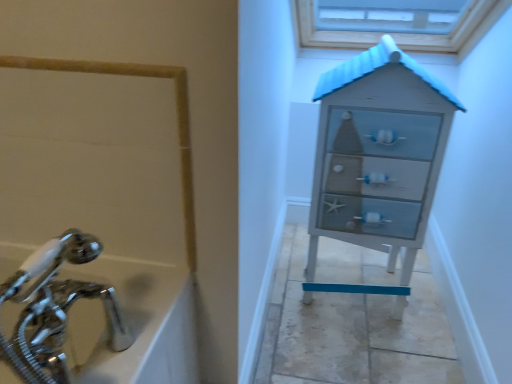
Question: Is distressed white chest of drawers at right taller or shorter than chrome metallic faucet at lower left?

Choices:
 (A) tall
 (B) short

Answer: (A)

Question: From a real-world perspective, is distressed white chest of drawers at right physically located above or below chrome metallic faucet at lower left?

Choices:
 (A) above
 (B) below

Answer: (B)

Question: Looking at their shapes, would you say distressed white chest of drawers at right is wider or thinner than chrome metallic faucet at lower left?

Choices:
 (A) wide
 (B) thin

Answer: (A)

Question: Based on their positions, is chrome metallic faucet at lower left located to the left or right of distressed white chest of drawers at right?

Choices:
 (A) left
 (B) right

Answer: (A)

Question: Is chrome metallic faucet at lower left situated inside distressed white chest of drawers at right or outside?

Choices:
 (A) inside
 (B) outside

Answer: (B)

Question: Considering the positions of chrome metallic faucet at lower left and distressed white chest of drawers at right in the image, is chrome metallic faucet at lower left wider or thinner than distressed white chest of drawers at right?

Choices:
 (A) thin
 (B) wide

Answer: (A)

Question: From a real-world perspective, is chrome metallic faucet at lower left physically located above or below distressed white chest of drawers at right?

Choices:
 (A) below
 (B) above

Answer: (B)